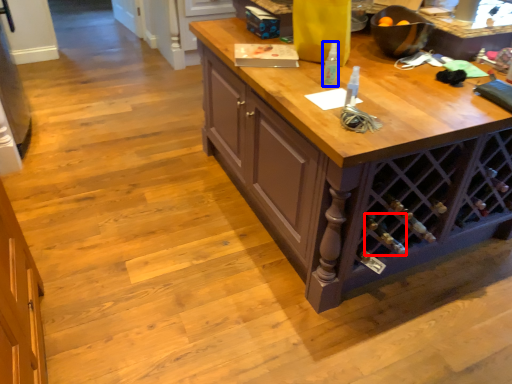
Question: Which of the following is the farthest to the observer, wine bottle (highlighted by a red box) or bottle (highlighted by a blue box)?

Choices:
 (A) wine bottle
 (B) bottle

Answer: (A)